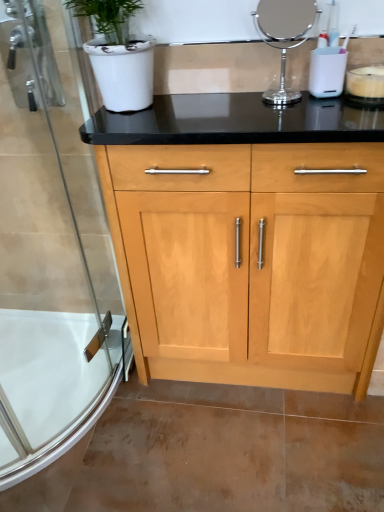
Question: Could you tell me if polished chrome mirror at upper center is turned towards white glossy bath at lower left?

Choices:
 (A) yes
 (B) no

Answer: (B)

Question: Is polished chrome mirror at upper center completely or partially outside of white glossy bath at lower left?

Choices:
 (A) no
 (B) yes

Answer: (B)

Question: Does polished chrome mirror at upper center have a greater width compared to white glossy bath at lower left?

Choices:
 (A) no
 (B) yes

Answer: (A)

Question: Is polished chrome mirror at upper center at the left side of white glossy bath at lower left?

Choices:
 (A) no
 (B) yes

Answer: (A)

Question: Does polished chrome mirror at upper center have a lesser height compared to white glossy bath at lower left?

Choices:
 (A) yes
 (B) no

Answer: (B)

Question: Do you think clear glass shower door at left is within polished chrome mirror at upper center, or outside of it?

Choices:
 (A) outside
 (B) inside

Answer: (A)

Question: Considering the positions of point (104, 390) and point (264, 98), is point (104, 390) closer or farther from the camera than point (264, 98)?

Choices:
 (A) farther
 (B) closer

Answer: (A)

Question: Looking at their shapes, would you say clear glass shower door at left is wider or thinner than polished chrome mirror at upper center?

Choices:
 (A) thin
 (B) wide

Answer: (B)

Question: Considering the positions of clear glass shower door at left and polished chrome mirror at upper center in the image, is clear glass shower door at left bigger or smaller than polished chrome mirror at upper center?

Choices:
 (A) big
 (B) small

Answer: (A)

Question: Based on their positions, is clear glass shower door at left located to the left or right of white matte candle at upper right?

Choices:
 (A) right
 (B) left

Answer: (B)

Question: Is point (8, 101) closer or farther from the camera than point (380, 71)?

Choices:
 (A) farther
 (B) closer

Answer: (A)

Question: From the image's perspective, relative to white matte candle at upper right, is clear glass shower door at left above or below?

Choices:
 (A) below
 (B) above

Answer: (A)

Question: Is clear glass shower door at left taller or shorter than white matte candle at upper right?

Choices:
 (A) tall
 (B) short

Answer: (A)

Question: Is white glossy bath at lower left wider or thinner than white matte candle at upper right?

Choices:
 (A) wide
 (B) thin

Answer: (A)

Question: Looking at the image, does white glossy bath at lower left seem bigger or smaller compared to white matte candle at upper right?

Choices:
 (A) big
 (B) small

Answer: (A)